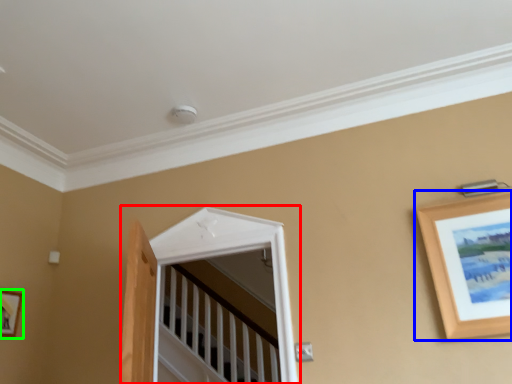
Question: Based on their relative distances, which object is farther from window (highlighted by a red box)? Choose from picture frame (highlighted by a blue box) and picture frame (highlighted by a green box).

Choices:
 (A) picture frame
 (B) picture frame

Answer: (B)